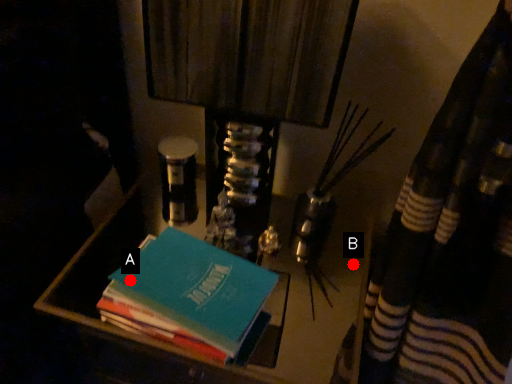
Question: Two points are circled on the image, labeled by A and B beside each circle. Which point is farther from the camera taking this photo?

Choices:
 (A) A is further
 (B) B is further

Answer: (B)